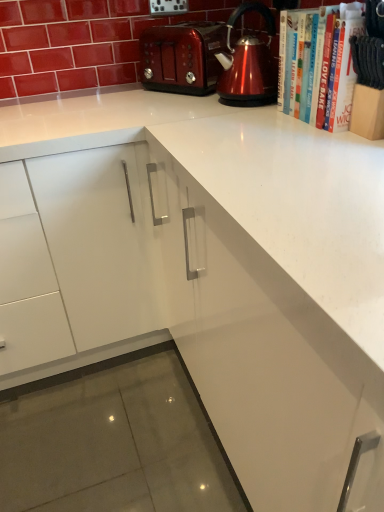
Question: From a real-world perspective, relative to shiny metallic toaster at upper center, is white paper book at upper right, arranged as the first book when viewed from the front, vertically above or below?

Choices:
 (A) below
 (B) above

Answer: (B)

Question: From the image's perspective, is white paper book at upper right, arranged as the first book when viewed from the front, above or below shiny metallic toaster at upper center?

Choices:
 (A) below
 (B) above

Answer: (A)

Question: Considering the real-world distances, which object is closest to the white paper book at upper right, arranged as the 1th book when viewed from the back?

Choices:
 (A) white paper book at upper right, arranged as the first book when viewed from the front
 (B) shiny metallic kettle at upper right
 (C) shiny metallic toaster at upper center

Answer: (A)

Question: Considering the real-world distances, which object is closest to the shiny metallic kettle at upper right?

Choices:
 (A) shiny metallic toaster at upper center
 (B) white paper book at upper right, arranged as the 1th book when viewed from the back
 (C) white paper book at upper right, the second book viewed from the back

Answer: (B)